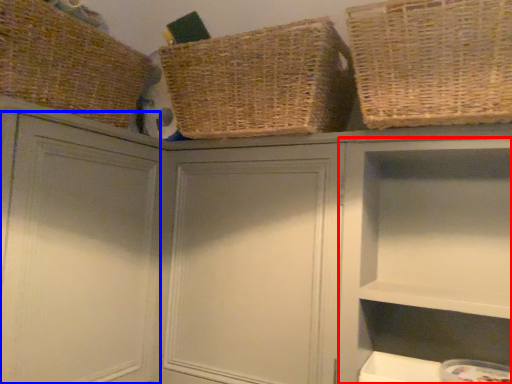
Question: Which object is further to the camera taking this photo, cabinet (highlighted by a red box) or cabinet (highlighted by a blue box)?

Choices:
 (A) cabinet
 (B) cabinet

Answer: (A)